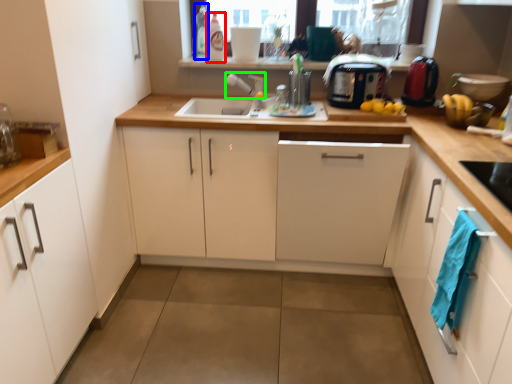
Question: Based on their relative distances, which object is farther from bottle (highlighted by a red box)? Choose from bottle (highlighted by a blue box) and faucet (highlighted by a green box).

Choices:
 (A) bottle
 (B) faucet

Answer: (B)